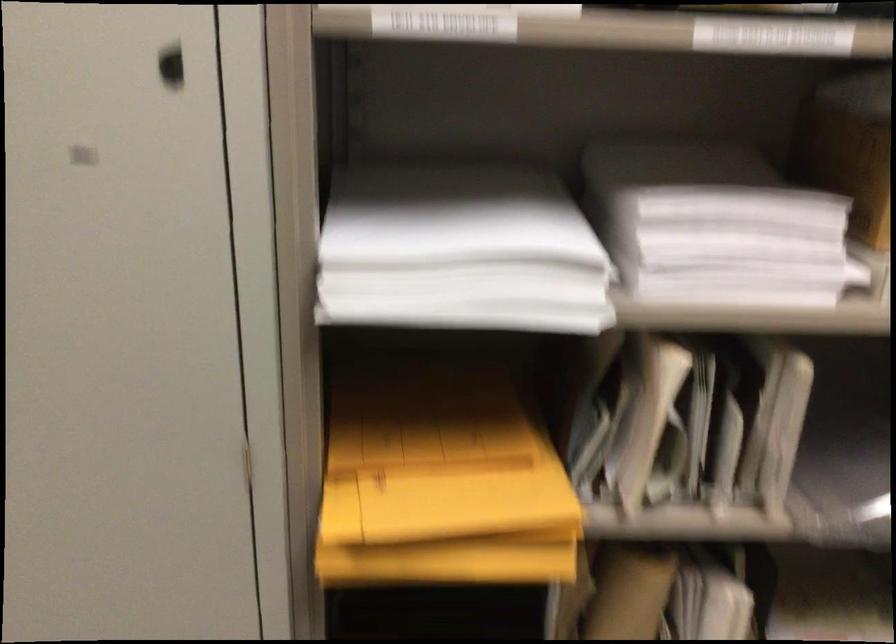
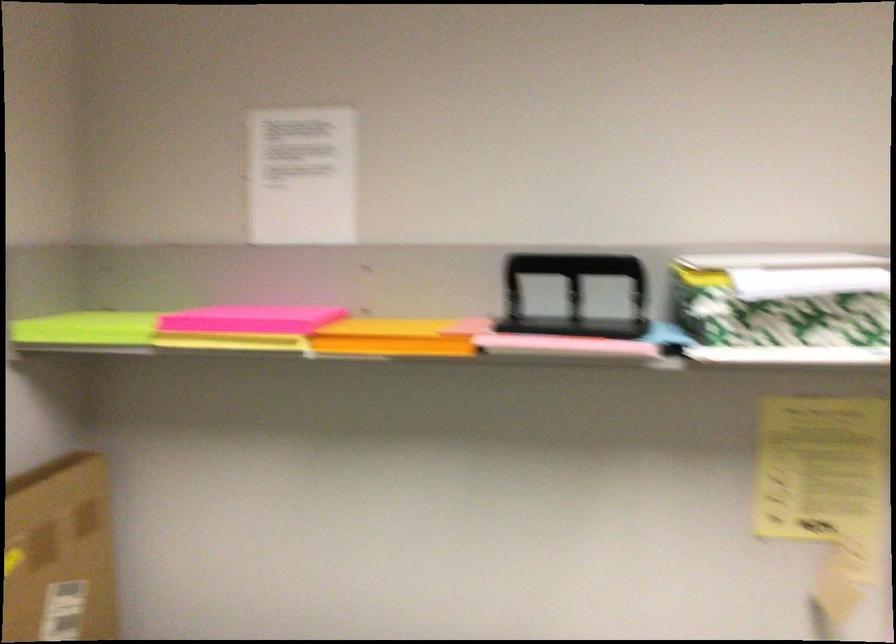
First-person continuous shooting, in which direction is the camera rotating?

The camera's rotation is toward right-down.